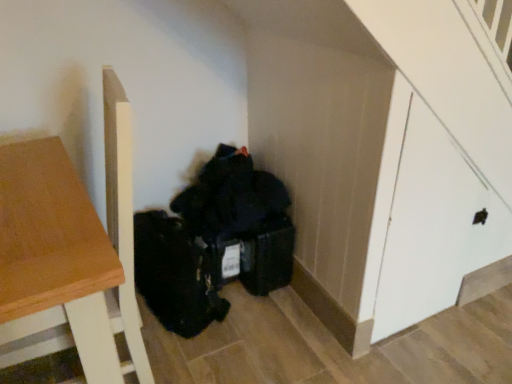
Question: From the image's perspective, is wooden table at left positioned above or below white matte door at right?

Choices:
 (A) below
 (B) above

Answer: (A)

Question: Looking at the image, does wooden table at left seem bigger or smaller compared to white matte door at right?

Choices:
 (A) small
 (B) big

Answer: (B)

Question: In the image, is wooden table at left positioned in front of or behind white matte door at right?

Choices:
 (A) front
 (B) behind

Answer: (A)

Question: From the image's perspective, relative to wooden table at left, is white matte door at right above or below?

Choices:
 (A) below
 (B) above

Answer: (B)

Question: Do you think white matte door at right is within wooden table at left, or outside of it?

Choices:
 (A) inside
 (B) outside

Answer: (B)

Question: Relative to wooden table at left, is white matte door at right in front or behind?

Choices:
 (A) behind
 (B) front

Answer: (A)

Question: From a real-world perspective, is white matte door at right above or below wooden table at left?

Choices:
 (A) above
 (B) below

Answer: (A)